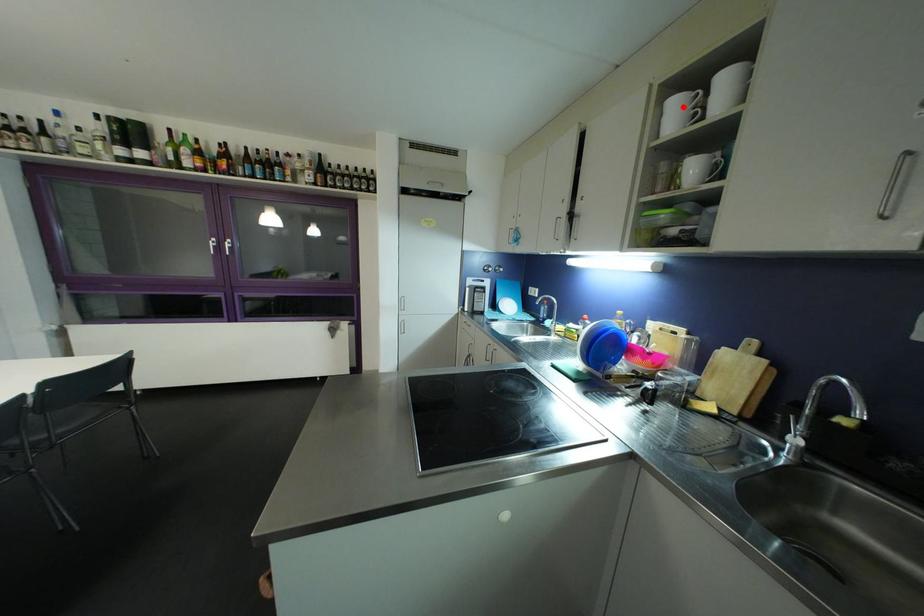
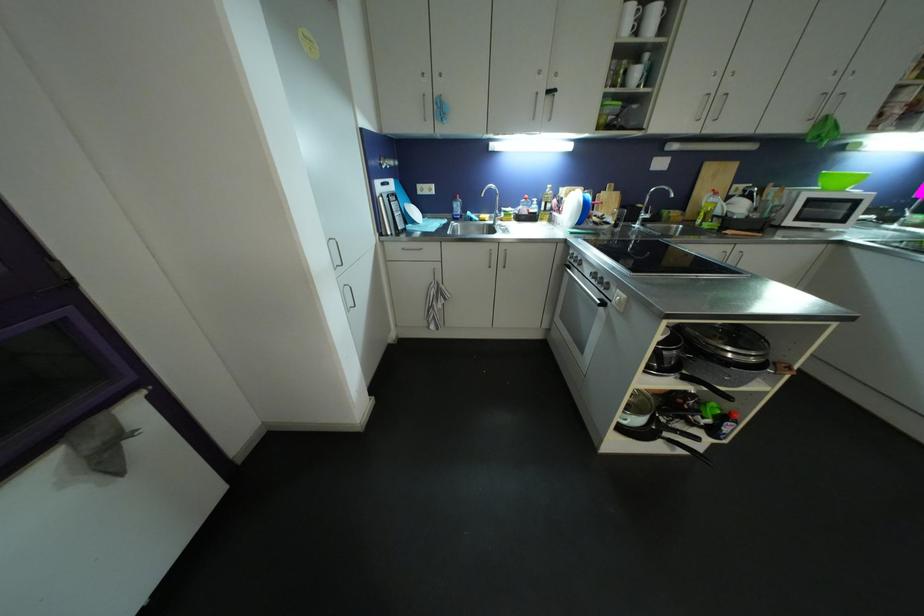
In the second image, find the point that corresponds to the highlighted location in the first image.

(638, 13)